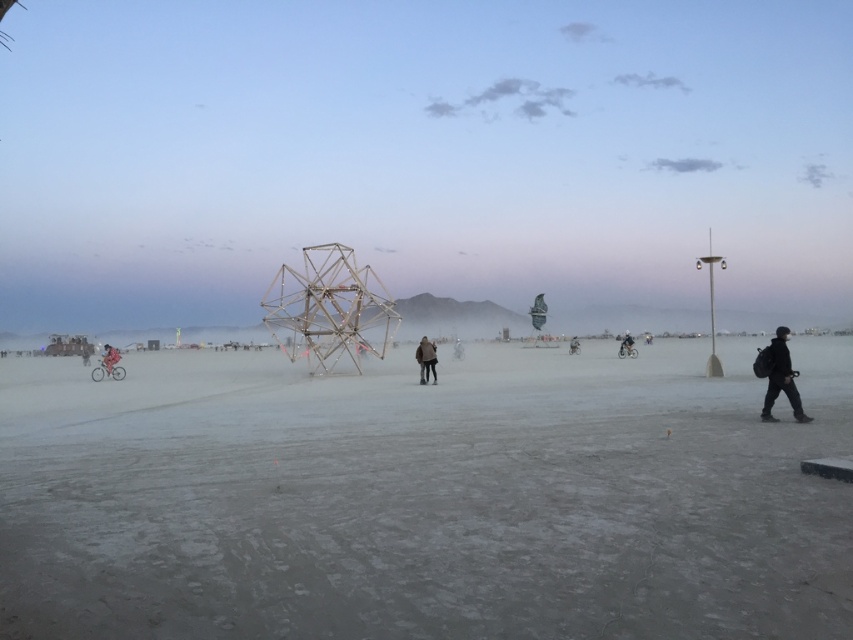
You are standing in the desert and see the brushed metal bicycle at left and the dark gray jacket at center. Which object is nearer to you?

The brushed metal bicycle at left is closer to the viewer than the dark gray jacket at center.

Based on the photo, you are standing in the desert and see the brown leather jacket at center. If you walk 10 meters north, will you be closer to the jacket?

The brown leather jacket at center is located at point [426,358]. Walking north would move you away from the jacket, so you would not be closer.